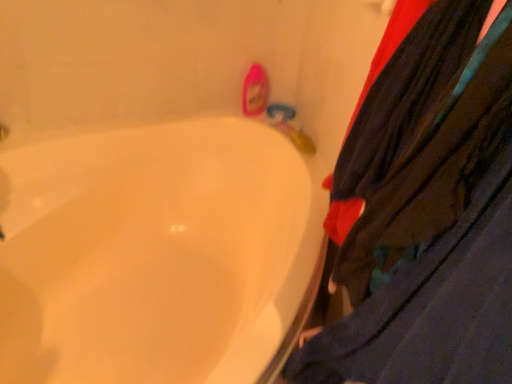
What do you see at coordinates (155, 254) in the screenshot? I see `white glossy bathtub at lower left` at bounding box center [155, 254].

Locate an element on the screen. Image resolution: width=512 pixels, height=384 pixels. white glossy bathtub at lower left is located at coordinates (155, 254).

Describe the element at coordinates (426, 214) in the screenshot. The height and width of the screenshot is (384, 512). I see `velvet-like dark blue pants at right` at that location.

This screenshot has width=512, height=384. Identify the location of velvet-like dark blue pants at right. (426, 214).

You are a GUI agent. You are given a task and a screenshot of the screen. Output one action in this format:
    pyautogui.click(x=<x>, y=<y>)
    Task: Click on the white glossy bathtub at lower left
    The width and height of the screenshot is (512, 384).
    Given the screenshot: What is the action you would take?
    pyautogui.click(x=155, y=254)

Which object is positioned more to the right, white glossy bathtub at lower left or velvet-like dark blue pants at right?

Positioned to the right is velvet-like dark blue pants at right.

Consider the image. Is the depth of white glossy bathtub at lower left greater than that of velvet-like dark blue pants at right?

Yes, white glossy bathtub at lower left is behind velvet-like dark blue pants at right.

Is point (29, 255) closer or farther from the camera than point (446, 216)?

Clearly, point (29, 255) is more distant from the camera than point (446, 216).

From the image's perspective, is white glossy bathtub at lower left located above or below velvet-like dark blue pants at right?

Clearly, from the image's perspective, white glossy bathtub at lower left is below velvet-like dark blue pants at right.

Looking at this image, from a real-world perspective, relative to velvet-like dark blue pants at right, is white glossy bathtub at lower left vertically above or below?

white glossy bathtub at lower left is below velvet-like dark blue pants at right.

Considering the relative sizes of white glossy bathtub at lower left and velvet-like dark blue pants at right in the image provided, is white glossy bathtub at lower left wider than velvet-like dark blue pants at right?

Yes.

Consider the image. Considering the sizes of objects white glossy bathtub at lower left and velvet-like dark blue pants at right in the image provided, who is shorter, white glossy bathtub at lower left or velvet-like dark blue pants at right?

white glossy bathtub at lower left is shorter.

Can you confirm if white glossy bathtub at lower left is bigger than velvet-like dark blue pants at right?

Yes.

Would you say white glossy bathtub at lower left is outside velvet-like dark blue pants at right?

That's correct, white glossy bathtub at lower left is outside of velvet-like dark blue pants at right.

Consider the image. Does white glossy bathtub at lower left touch velvet-like dark blue pants at right?

white glossy bathtub at lower left and velvet-like dark blue pants at right are not in contact.

Is white glossy bathtub at lower left oriented towards velvet-like dark blue pants at right?

No, white glossy bathtub at lower left is not aimed at velvet-like dark blue pants at right.

How much distance is there between white glossy bathtub at lower left and velvet-like dark blue pants at right?

A distance of 61.17 centimeters exists between white glossy bathtub at lower left and velvet-like dark blue pants at right.

What are the coordinates of `bathtub behind the velvet-like dark blue pants at right` in the screenshot? It's located at (155, 254).

Which is more to the right, velvet-like dark blue pants at right or white glossy bathtub at lower left?

velvet-like dark blue pants at right.

Between velvet-like dark blue pants at right and white glossy bathtub at lower left, which one is positioned behind?

white glossy bathtub at lower left is further from the camera.

Is point (499, 299) positioned after point (209, 211)?

No.

From the image's perspective, which one is positioned lower, velvet-like dark blue pants at right or white glossy bathtub at lower left?

white glossy bathtub at lower left appears lower in the image.

Consider the image. From a real-world perspective, which is physically above, velvet-like dark blue pants at right or white glossy bathtub at lower left?

In real-world perspective, velvet-like dark blue pants at right is above.

In terms of width, does velvet-like dark blue pants at right look wider or thinner when compared to white glossy bathtub at lower left?

In the image, velvet-like dark blue pants at right appears to be more narrow than white glossy bathtub at lower left.

Considering the relative sizes of velvet-like dark blue pants at right and white glossy bathtub at lower left in the image provided, is velvet-like dark blue pants at right taller than white glossy bathtub at lower left?

Indeed, velvet-like dark blue pants at right has a greater height compared to white glossy bathtub at lower left.

In the scene shown: Looking at the image, does velvet-like dark blue pants at right seem bigger or smaller compared to white glossy bathtub at lower left?

velvet-like dark blue pants at right is smaller than white glossy bathtub at lower left.

Consider the image. Would you say velvet-like dark blue pants at right is inside or outside white glossy bathtub at lower left?

velvet-like dark blue pants at right is spatially situated outside white glossy bathtub at lower left.

Are velvet-like dark blue pants at right and white glossy bathtub at lower left making contact?

No, velvet-like dark blue pants at right is not making contact with white glossy bathtub at lower left.

Is velvet-like dark blue pants at right turned away from white glossy bathtub at lower left?

No, white glossy bathtub at lower left is not at the back of velvet-like dark blue pants at right.

How different are the orientations of velvet-like dark blue pants at right and white glossy bathtub at lower left in degrees?

velvet-like dark blue pants at right and white glossy bathtub at lower left are facing 87.3 degrees away from each other.

Locate an element on the screen. bathtub on the left of the velvet-like dark blue pants at right is located at coordinates (155, 254).

The width and height of the screenshot is (512, 384). Identify the location of clothing above the white glossy bathtub at lower left (from the image's perspective). (426, 214).

The image size is (512, 384). What are the coordinates of `clothing in front of the white glossy bathtub at lower left` in the screenshot? It's located at (426, 214).